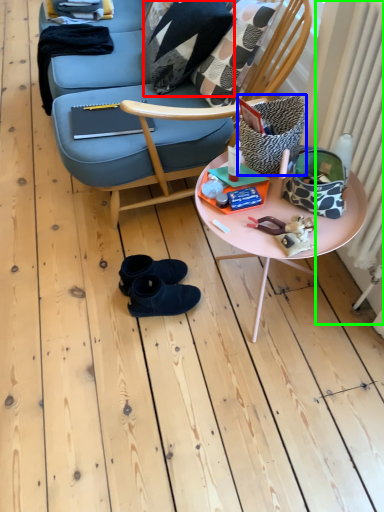
Question: Which object is positioned farthest from pillow (highlighted by a red box)? Select from pillow (highlighted by a blue box) and radiator (highlighted by a green box).

Choices:
 (A) pillow
 (B) radiator

Answer: (A)